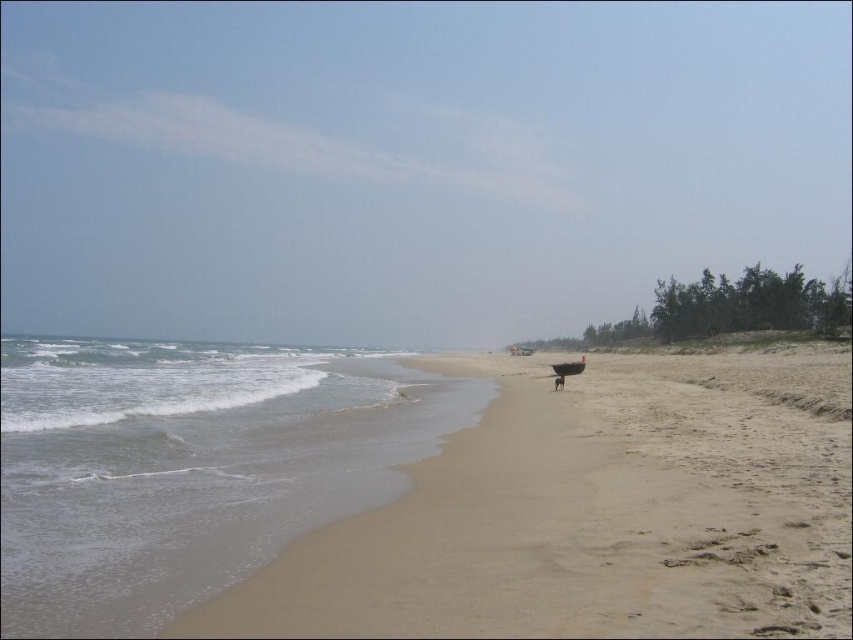
You are standing on the beach and want to place a small flag exactly where the light beige sand at lower left is located. According to the coordinates provided, where should you place the flag?

You should place the flag at the coordinates point [593,513] where the light beige sand at lower left is located.

You are standing on the beach looking towards the ocean. You see light beige sand at lower left and gray sand at lower left. Which of these two sands is positioned more to the right from your perspective?

The light beige sand at lower left is positioned more to the right than the gray sand at lower left according to the description.